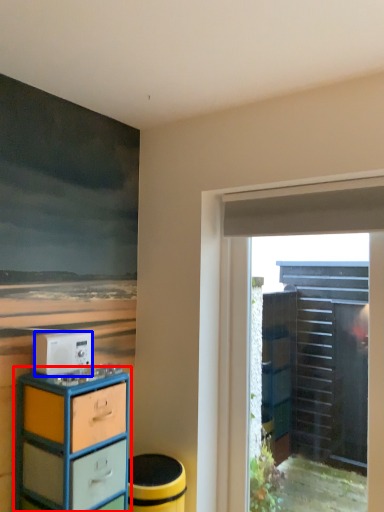
Question: Which object is further to the camera taking this photo, chest of drawers (highlighted by a red box) or appliance (highlighted by a blue box)?

Choices:
 (A) chest of drawers
 (B) appliance

Answer: (B)